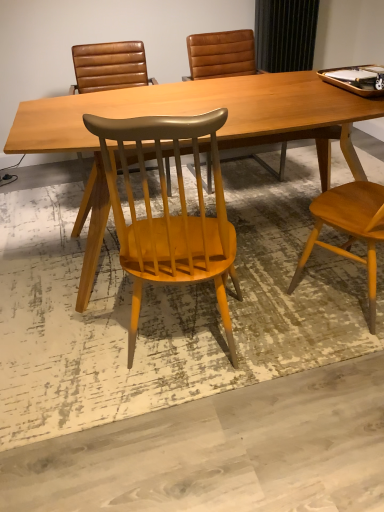
What do you see at coordinates (169, 214) in the screenshot? I see `matte wood chair at center, marked as the 3th chair in a back-to-front arrangement` at bounding box center [169, 214].

How much space does brown leather chair at upper center, which appears as the second chair when viewed from the front, occupy vertically?

brown leather chair at upper center, which appears as the second chair when viewed from the front, is 24.88 inches in height.

Where is `matte wood chair at center, marked as the 3th chair in a back-to-front arrangement`? This screenshot has width=384, height=512. matte wood chair at center, marked as the 3th chair in a back-to-front arrangement is located at coordinates (169, 214).

Between point (28, 110) and point (160, 168), which one is positioned behind?

Point (28, 110)

Does light brown wood desk at center turn towards matte wood chair at center, positioned as the 1th chair in front-to-back order?

Yes.

Does light brown wood desk at center have a greater height compared to matte wood chair at center, marked as the 3th chair in a back-to-front arrangement?

No.

What's the angular difference between light brown wood desk at center and matte wood chair at center, marked as the 3th chair in a back-to-front arrangement,'s facing directions?

There is a 169-degree angle between the facing directions of light brown wood desk at center and matte wood chair at center, marked as the 3th chair in a back-to-front arrangement.

Is brown leather chair at upper center, which appears as the second chair when viewed from the front, located outside matte brown leather chair at center, which is the third chair in front-to-back order?

That's correct, brown leather chair at upper center, which appears as the second chair when viewed from the front, is outside of matte brown leather chair at center, which is the third chair in front-to-back order.

How different are the orientations of brown leather chair at upper center, which is the second chair from back to front, and matte brown leather chair at center, the 1th chair when ordered from back to front, in degrees?

brown leather chair at upper center, which is the second chair from back to front, and matte brown leather chair at center, the 1th chair when ordered from back to front, are facing 4.02 degrees away from each other.

Who is taller, brown leather chair at upper center, which is the second chair from back to front, or matte brown leather chair at center, the 1th chair when ordered from back to front?

matte brown leather chair at center, the 1th chair when ordered from back to front, is taller.

Is point (123, 74) farther from camera compared to point (202, 47)?

That is False.

Between matte wood chair at center, marked as the 3th chair in a back-to-front arrangement, and matte brown leather chair at center, the 1th chair when ordered from back to front, which one has less height?

With less height is matte brown leather chair at center, the 1th chair when ordered from back to front.

Does matte wood chair at center, marked as the 3th chair in a back-to-front arrangement, turn towards matte brown leather chair at center, which is the third chair in front-to-back order?

Yes, matte wood chair at center, marked as the 3th chair in a back-to-front arrangement, is turned towards matte brown leather chair at center, which is the third chair in front-to-back order.

Does matte wood chair at center, marked as the 3th chair in a back-to-front arrangement, have a lesser width compared to matte brown leather chair at center, the 1th chair when ordered from back to front?

Yes.

From a real-world perspective, who is located higher, matte wood chair at center, marked as the 3th chair in a back-to-front arrangement, or matte brown leather chair at center, which is the third chair in front-to-back order?

From a 3D spatial view, matte wood chair at center, marked as the 3th chair in a back-to-front arrangement, is above.

Does light brown wood desk at center have a smaller size compared to brown leather chair at upper center, which is the second chair from back to front?

No, light brown wood desk at center is not smaller than brown leather chair at upper center, which is the second chair from back to front.

Can brown leather chair at upper center, which is the second chair from back to front, be found inside light brown wood desk at center?

No, brown leather chair at upper center, which is the second chair from back to front, is not surrounded by light brown wood desk at center.

From the light brown wood desk at center, count the 2nd chair to the left and point to it. Please provide its 2D coordinates.

[(109, 66)]

Is light brown wood desk at center at the left side of brown leather chair at upper center, which is the second chair from back to front?

In fact, light brown wood desk at center is to the right of brown leather chair at upper center, which is the second chair from back to front.

Considering the sizes of objects matte brown leather chair at center, the 1th chair when ordered from back to front, and matte wood chair at center, marked as the 3th chair in a back-to-front arrangement, in the image provided, who is bigger, matte brown leather chair at center, the 1th chair when ordered from back to front, or matte wood chair at center, marked as the 3th chair in a back-to-front arrangement,?

matte brown leather chair at center, the 1th chair when ordered from back to front.

Which of these two, matte brown leather chair at center, which is the third chair in front-to-back order, or matte wood chair at center, positioned as the 1th chair in front-to-back order, stands taller?

With more height is matte wood chair at center, positioned as the 1th chair in front-to-back order.

Can matte wood chair at center, positioned as the 1th chair in front-to-back order, be found inside matte brown leather chair at center, the 1th chair when ordered from back to front?

No, matte wood chair at center, positioned as the 1th chair in front-to-back order, is not surrounded by matte brown leather chair at center, the 1th chair when ordered from back to front.

Is matte brown leather chair at center, which is the third chair in front-to-back order, looking in the opposite direction of matte wood chair at center, positioned as the 1th chair in front-to-back order?

No, matte brown leather chair at center, which is the third chair in front-to-back order,'s orientation is not away from matte wood chair at center, positioned as the 1th chair in front-to-back order.

Find the location of a particular element. Image resolution: width=384 pixels, height=512 pixels. chair below the light brown wood desk at center (from the image's perspective) is located at coordinates (169, 214).

Considering the positions of point (86, 117) and point (179, 100), is point (86, 117) closer or farther from the camera than point (179, 100)?

Point (86, 117) is closer to the camera than point (179, 100).

Is matte wood chair at center, marked as the 3th chair in a back-to-front arrangement, oriented towards light brown wood desk at center?

Yes, matte wood chair at center, marked as the 3th chair in a back-to-front arrangement, is aimed at light brown wood desk at center.

Between matte wood chair at center, positioned as the 1th chair in front-to-back order, and light brown wood desk at center, which one has more height?

matte wood chair at center, positioned as the 1th chair in front-to-back order, is taller.

Is brown leather chair at upper center, which is the second chair from back to front, further to the viewer compared to light brown wood desk at center?

Yes, the depth of brown leather chair at upper center, which is the second chair from back to front, is greater than that of light brown wood desk at center.

Considering the sizes of objects brown leather chair at upper center, which is the second chair from back to front, and light brown wood desk at center in the image provided, who is wider, brown leather chair at upper center, which is the second chair from back to front, or light brown wood desk at center?

With larger width is light brown wood desk at center.

Which is behind, point (96, 73) or point (291, 88)?

The point (96, 73) is farther from the camera.

Could you tell me if brown leather chair at upper center, which is the second chair from back to front, is turned towards light brown wood desk at center?

Yes, brown leather chair at upper center, which is the second chair from back to front, faces towards light brown wood desk at center.

The image size is (384, 512). I want to click on desk directly beneath the matte wood chair at center, positioned as the 1th chair in front-to-back order (from a real-world perspective), so click(191, 114).

This screenshot has width=384, height=512. I want to click on chair that is above the brown leather chair at upper center, which is the second chair from back to front (from the image's perspective), so click(221, 55).

Based on their spatial positions, is light brown wood desk at center or brown leather chair at upper center, which is the second chair from back to front, further from matte wood chair at center, positioned as the 1th chair in front-to-back order?

Based on the image, brown leather chair at upper center, which is the second chair from back to front, appears to be further to matte wood chair at center, positioned as the 1th chair in front-to-back order.

Considering their positions, is matte brown leather chair at center, which is the third chair in front-to-back order, positioned closer to brown leather chair at upper center, which appears as the second chair when viewed from the front, than light brown wood desk at center?

Among the two, matte brown leather chair at center, which is the third chair in front-to-back order, is located nearer to brown leather chair at upper center, which appears as the second chair when viewed from the front.

Estimate the real-world distances between objects in this image. Which object is closer to light brown wood desk at center, brown leather chair at upper center, which appears as the second chair when viewed from the front, or matte brown leather chair at center, the 1th chair when ordered from back to front?

Among the two, brown leather chair at upper center, which appears as the second chair when viewed from the front, is located nearer to light brown wood desk at center.

Considering their positions, is light brown wood desk at center positioned closer to matte wood chair at center, positioned as the 1th chair in front-to-back order, than matte brown leather chair at center, the 1th chair when ordered from back to front?

Based on the image, light brown wood desk at center appears to be nearer to matte wood chair at center, positioned as the 1th chair in front-to-back order.

When comparing their distances from matte wood chair at center, marked as the 3th chair in a back-to-front arrangement, does brown leather chair at upper center, which appears as the second chair when viewed from the front, or matte brown leather chair at center, which is the third chair in front-to-back order, seem closer?

brown leather chair at upper center, which appears as the second chair when viewed from the front, lies closer to matte wood chair at center, marked as the 3th chair in a back-to-front arrangement, than the other object.

Estimate the real-world distances between objects in this image. Which object is further from matte brown leather chair at center, which is the third chair in front-to-back order, matte wood chair at center, positioned as the 1th chair in front-to-back order, or brown leather chair at upper center, which appears as the second chair when viewed from the front?

Among the two, matte wood chair at center, positioned as the 1th chair in front-to-back order, is located further to matte brown leather chair at center, which is the third chair in front-to-back order.

Looking at this image, based on their spatial positions, is matte brown leather chair at center, the 1th chair when ordered from back to front, or matte wood chair at center, marked as the 3th chair in a back-to-front arrangement, closer to brown leather chair at upper center, which is the second chair from back to front?

The object closer to brown leather chair at upper center, which is the second chair from back to front, is matte brown leather chair at center, the 1th chair when ordered from back to front.

Looking at the image, which one is located further to brown leather chair at upper center, which appears as the second chair when viewed from the front, light brown wood desk at center or matte wood chair at center, positioned as the 1th chair in front-to-back order?

matte wood chair at center, positioned as the 1th chair in front-to-back order, is further to brown leather chair at upper center, which appears as the second chair when viewed from the front.

This screenshot has height=512, width=384. Find the location of `chair between matte wood chair at center, marked as the 3th chair in a back-to-front arrangement, and matte brown leather chair at center, which is the third chair in front-to-back order, along the z-axis`. chair between matte wood chair at center, marked as the 3th chair in a back-to-front arrangement, and matte brown leather chair at center, which is the third chair in front-to-back order, along the z-axis is located at coordinates (109, 66).

Find the location of `desk between matte wood chair at center, positioned as the 1th chair in front-to-back order, and matte brown leather chair at center, which is the third chair in front-to-back order, along the z-axis`. desk between matte wood chair at center, positioned as the 1th chair in front-to-back order, and matte brown leather chair at center, which is the third chair in front-to-back order, along the z-axis is located at coordinates (191, 114).

Locate an element on the screen. chair located between light brown wood desk at center and matte brown leather chair at center, the 1th chair when ordered from back to front, in the depth direction is located at coordinates (109, 66).

In order to click on desk located between matte wood chair at center, positioned as the 1th chair in front-to-back order, and brown leather chair at upper center, which appears as the second chair when viewed from the front, in the depth direction in this screenshot , I will do `click(191, 114)`.